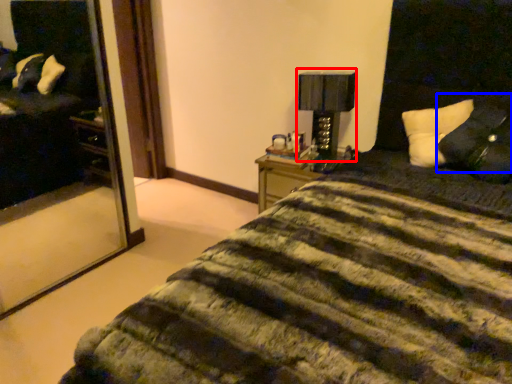
Question: Among these objects, which one is nearest to the camera, table lamp (highlighted by a red box) or pillow (highlighted by a blue box)?

Choices:
 (A) table lamp
 (B) pillow

Answer: (B)